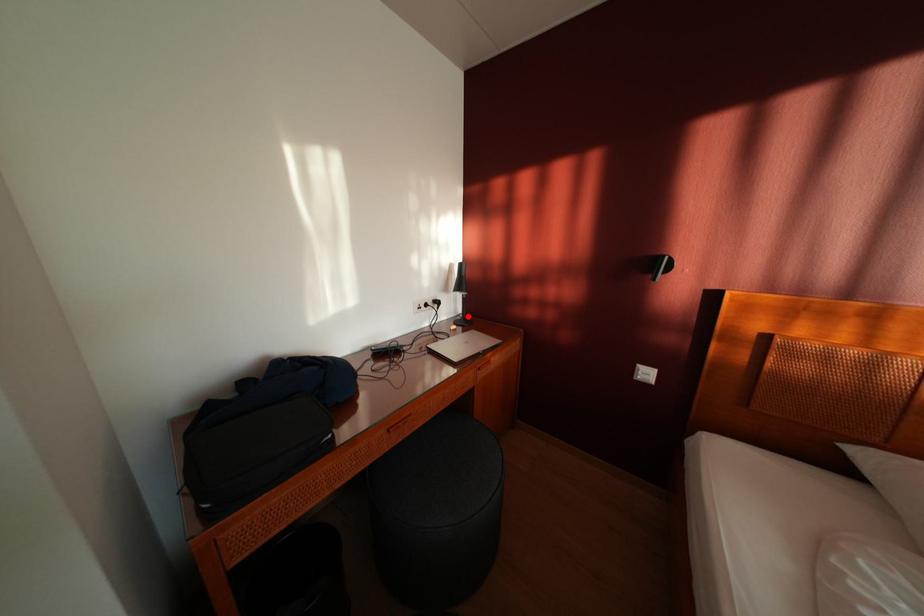
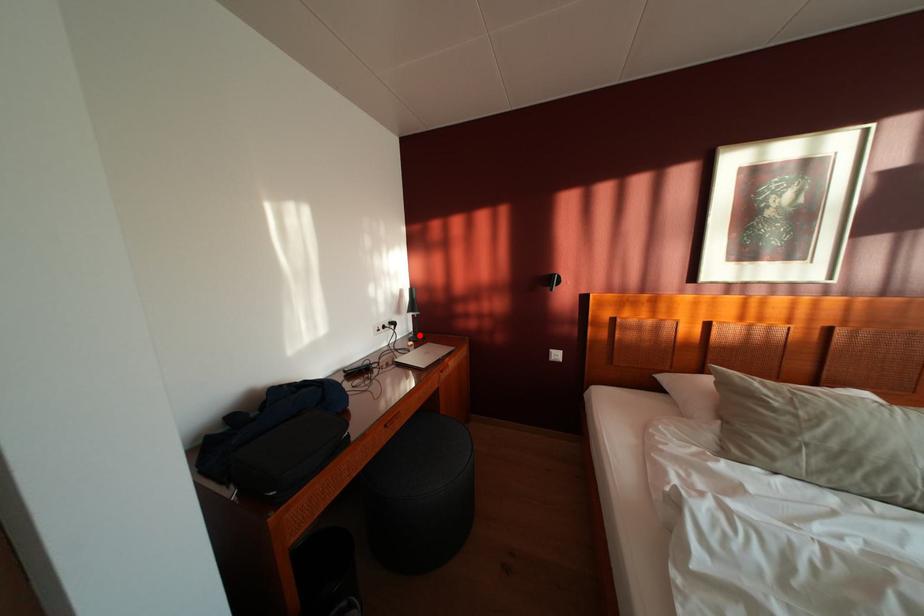
I am providing you with two images of the same scene from different viewpoints. A red point is marked on the first image and another point is marked on the second image. Do the highlighted points in image1 and image2 indicate the same real-world spot?

Yes